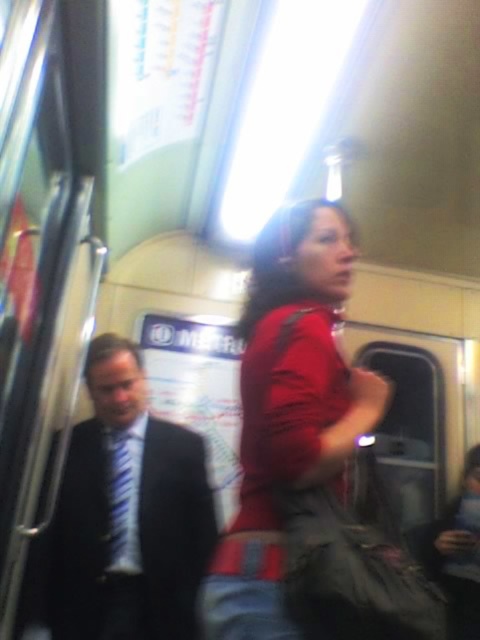
Is point (320, 237) positioned in front of point (167, 570)?

That is True.

Between point (271, 412) and point (181, 604), which one is positioned in front?

Point (271, 412) is in front.

Who is more forward, (298,385) or (60,621)?

Point (298,385) is more forward.

In order to click on matte red shirt at center in this screenshot , I will do `click(288, 410)`.